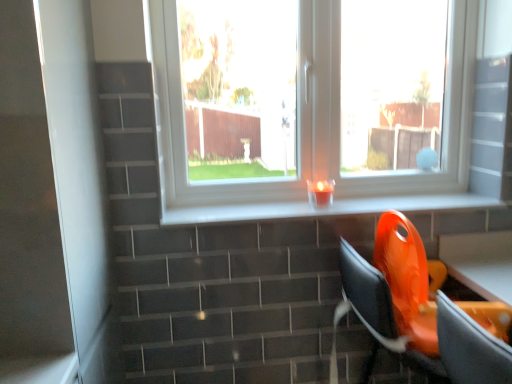
Question: Can you confirm if white glossy screen door at left is taller than white glossy window sill at center?

Choices:
 (A) yes
 (B) no

Answer: (A)

Question: Is white glossy screen door at left at the left side of white glossy window sill at center?

Choices:
 (A) yes
 (B) no

Answer: (A)

Question: From the image's perspective, is white glossy screen door at left beneath white glossy window sill at center?

Choices:
 (A) yes
 (B) no

Answer: (A)

Question: Is white glossy screen door at left wider than white glossy window sill at center?

Choices:
 (A) yes
 (B) no

Answer: (A)

Question: Considering the relative sizes of white glossy screen door at left and white glossy window sill at center in the image provided, is white glossy screen door at left shorter than white glossy window sill at center?

Choices:
 (A) no
 (B) yes

Answer: (A)

Question: Considering the positions of point (354, 271) and point (391, 196), is point (354, 271) closer or farther from the camera than point (391, 196)?

Choices:
 (A) closer
 (B) farther

Answer: (A)

Question: Considering their positions, is orange plastic chair at lower right located in front of or behind transparent glass window at center?

Choices:
 (A) behind
 (B) front

Answer: (B)

Question: From a real-world perspective, is orange plastic chair at lower right above or below transparent glass window at center?

Choices:
 (A) below
 (B) above

Answer: (A)

Question: Is orange plastic chair at lower right taller or shorter than transparent glass window at center?

Choices:
 (A) short
 (B) tall

Answer: (A)

Question: Looking at their shapes, would you say orange plastic swivel chair at lower right is wider or thinner than translucent glass candle at center?

Choices:
 (A) wide
 (B) thin

Answer: (A)

Question: From the image's perspective, relative to translucent glass candle at center, is orange plastic swivel chair at lower right above or below?

Choices:
 (A) above
 (B) below

Answer: (B)

Question: From a real-world perspective, is orange plastic swivel chair at lower right positioned above or below translucent glass candle at center?

Choices:
 (A) below
 (B) above

Answer: (A)

Question: Based on their positions, is orange plastic swivel chair at lower right located to the left or right of translucent glass candle at center?

Choices:
 (A) right
 (B) left

Answer: (A)

Question: Would you say orange plastic chair at lower right is to the left or to the right of orange plastic swivel chair at lower right in the picture?

Choices:
 (A) left
 (B) right

Answer: (A)

Question: Is orange plastic chair at lower right bigger or smaller than orange plastic swivel chair at lower right?

Choices:
 (A) small
 (B) big

Answer: (B)